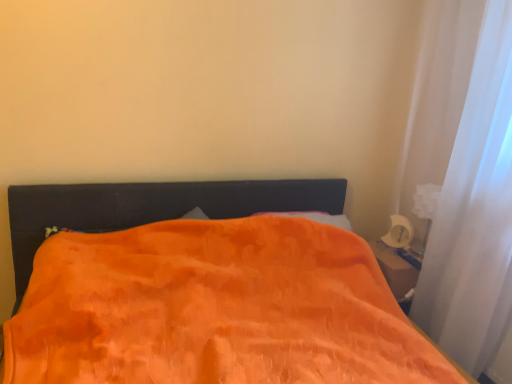
Question: Does point (239, 248) appear closer or farther from the camera than point (465, 286)?

Choices:
 (A) closer
 (B) farther

Answer: (B)

Question: Is orange soft blanket at center to the left or to the right of white sheer curtain at right in the image?

Choices:
 (A) right
 (B) left

Answer: (B)

Question: Considering the positions of orange soft blanket at center and white sheer curtain at right in the image, is orange soft blanket at center taller or shorter than white sheer curtain at right?

Choices:
 (A) tall
 (B) short

Answer: (B)

Question: Which is correct: white sheer curtain at right is inside orange soft blanket at center, or outside of it?

Choices:
 (A) inside
 (B) outside

Answer: (B)

Question: Looking at the image, does white sheer curtain at right seem bigger or smaller compared to orange soft blanket at center?

Choices:
 (A) small
 (B) big

Answer: (A)

Question: From a real-world perspective, relative to orange soft blanket at center, is white sheer curtain at right vertically above or below?

Choices:
 (A) below
 (B) above

Answer: (B)

Question: From the image's perspective, relative to orange soft blanket at center, is white sheer curtain at right above or below?

Choices:
 (A) above
 (B) below

Answer: (A)